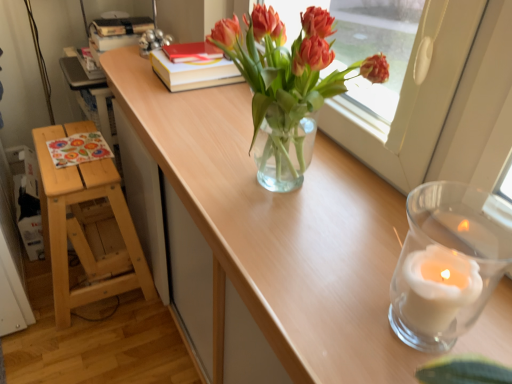
Question: Is clear wood table at center facing towards natural wood stool at left?

Choices:
 (A) no
 (B) yes

Answer: (A)

Question: From the image's perspective, is clear wood table at center located above natural wood stool at left?

Choices:
 (A) yes
 (B) no

Answer: (A)

Question: From a real-world perspective, is clear wood table at center located higher than natural wood stool at left?

Choices:
 (A) no
 (B) yes

Answer: (B)

Question: Considering the relative positions of clear wood table at center and natural wood stool at left in the image provided, is clear wood table at center in front of natural wood stool at left?

Choices:
 (A) yes
 (B) no

Answer: (A)

Question: Does clear wood table at center have a lesser width compared to natural wood stool at left?

Choices:
 (A) yes
 (B) no

Answer: (A)

Question: In the image, is hardcover book at center, the second book positioned from the top, positioned in front of or behind clear wood table at center?

Choices:
 (A) behind
 (B) front

Answer: (A)

Question: From their relative heights in the image, would you say hardcover book at center, marked as the 1th book in a bottom-to-top arrangement, is taller or shorter than clear wood table at center?

Choices:
 (A) tall
 (B) short

Answer: (B)

Question: From the image's perspective, is hardcover book at center, the second book positioned from the top, above or below clear wood table at center?

Choices:
 (A) below
 (B) above

Answer: (B)

Question: Would you say hardcover book at center, marked as the 1th book in a bottom-to-top arrangement, is to the left or to the right of clear wood table at center in the picture?

Choices:
 (A) left
 (B) right

Answer: (A)

Question: Would you say transparent glass candle at right is inside or outside clear wood table at center?

Choices:
 (A) inside
 (B) outside

Answer: (B)

Question: Is transparent glass candle at right bigger or smaller than clear wood table at center?

Choices:
 (A) big
 (B) small

Answer: (B)

Question: Considering the positions of transparent glass candle at right and clear wood table at center in the image, is transparent glass candle at right taller or shorter than clear wood table at center?

Choices:
 (A) short
 (B) tall

Answer: (B)

Question: Is transparent glass candle at right to the left or to the right of clear wood table at center in the image?

Choices:
 (A) right
 (B) left

Answer: (A)

Question: From the image's perspective, is natural wood stool at left located above or below hardcover book at center, the second book positioned from the top?

Choices:
 (A) above
 (B) below

Answer: (B)

Question: Based on their positions, is natural wood stool at left located to the left or right of hardcover book at center, marked as the 1th book in a bottom-to-top arrangement?

Choices:
 (A) right
 (B) left

Answer: (B)